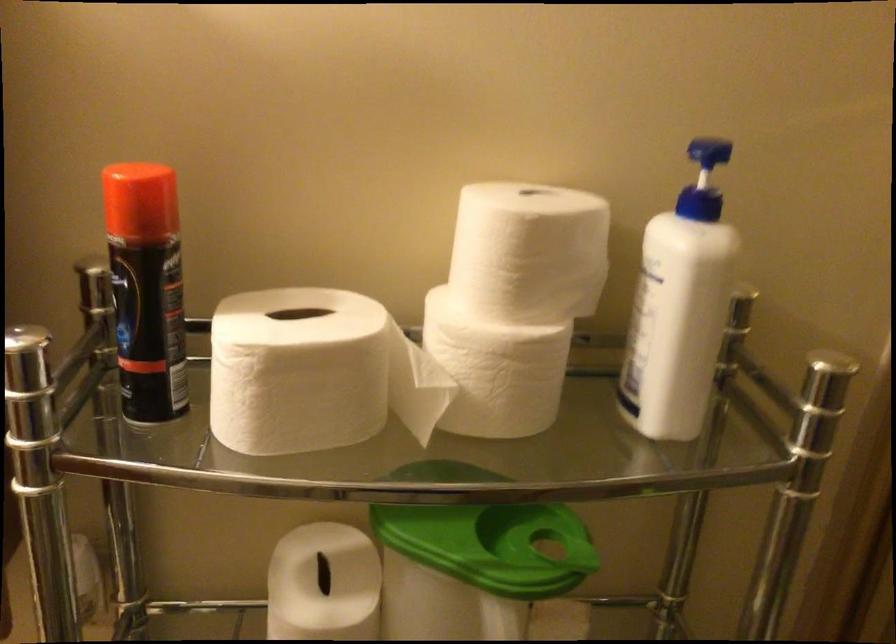
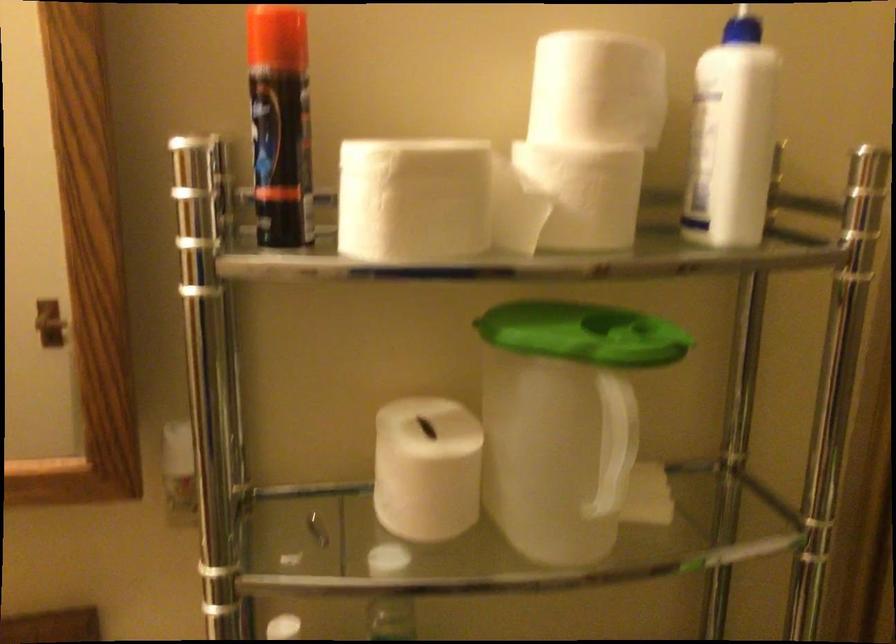
Find the pixel in the second image that matches (x=497, y=371) in the first image.

(588, 194)